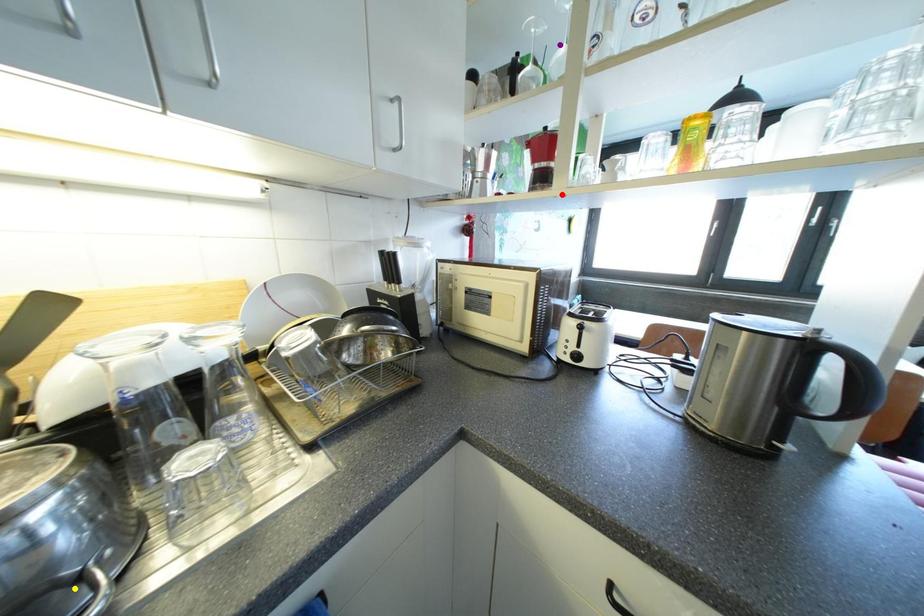
Order these from nearest to farthest:
red point
yellow point
purple point

yellow point
purple point
red point